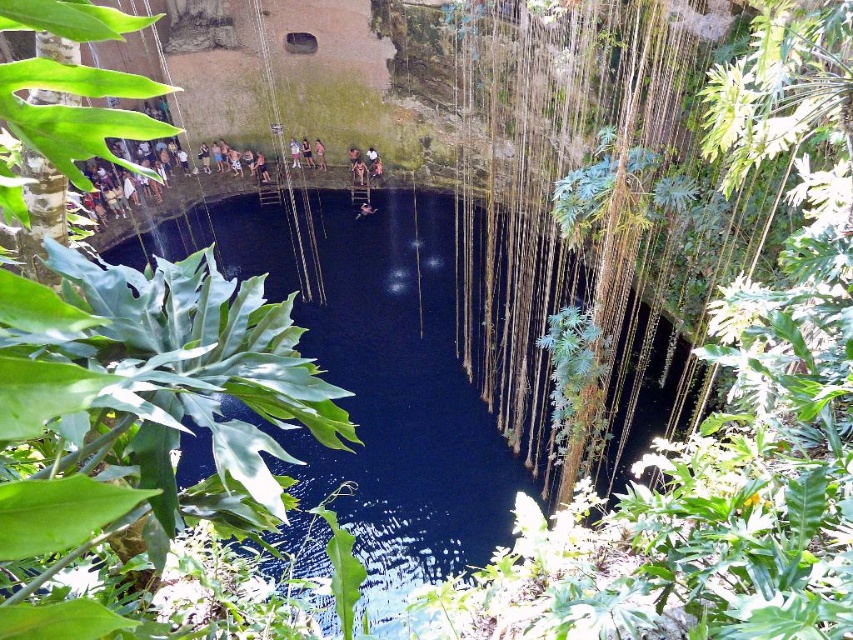
Question: Which object appears farthest from the camera in this image?

Choices:
 (A) light brown wooden ladder at upper center
 (B) light brown wooden pole at center
 (C) pink fabric dress at center
 (D) transparent water at center

Answer: (A)

Question: Which is nearer to the light brown wooden ladder at upper center?

Choices:
 (A) pink fabric dress at center
 (B) light brown wooden pole at center
 (C) transparent water at center

Answer: (B)

Question: Does transparent water at center have a lesser width compared to light brown wooden ladder at upper center?

Choices:
 (A) no
 (B) yes

Answer: (A)

Question: Which of the following is the farthest from the observer?

Choices:
 (A) (289, 147)
 (B) (305, 145)

Answer: (A)

Question: From the image, what is the correct spatial relationship of transparent water at center in relation to light brown wooden ladder at upper center?

Choices:
 (A) left
 (B) right

Answer: (B)

Question: Does transparent water at center appear on the left side of pink fabric dress at center?

Choices:
 (A) yes
 (B) no

Answer: (B)